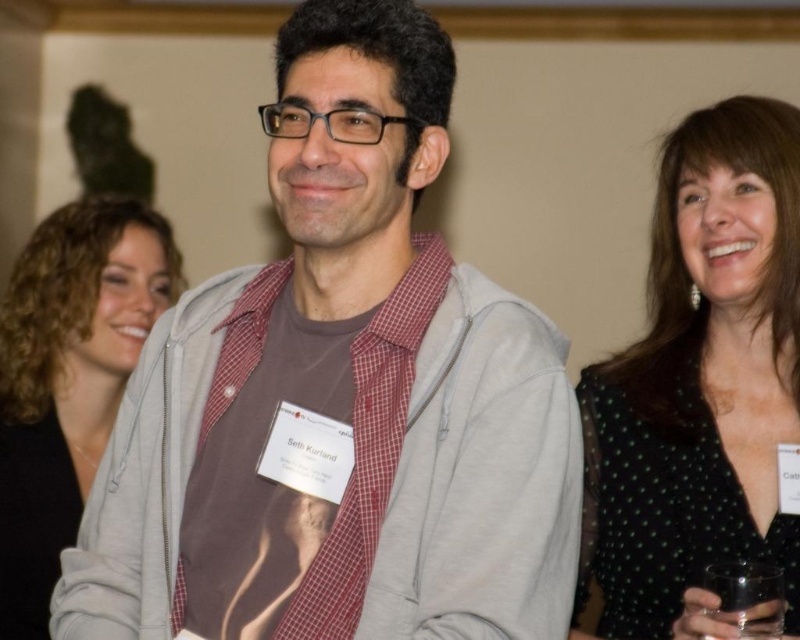
You are standing at the bottom left corner of the image. You want to hand a gift to Seth Kurland, who is wearing a gray hoodie at center. However, there is an obstacle at point (x=341, y=396). Can you walk straight towards the gray hoodie at center without passing through the obstacle?

The gray cotton hoodie at center is located at point (x=341, y=396), so walking straight towards it would require passing through the obstacle at that point. Therefore, you cannot walk straight to the gray hoodie at center without going through the obstacle.

You are organizing a charity event and need to place a decorative wreath on the gray cotton hoodie at center and the transparent glass at lower right. Which object requires a larger wreath?

The gray cotton hoodie at center requires a larger wreath because it might be wider than the transparent glass at lower right.